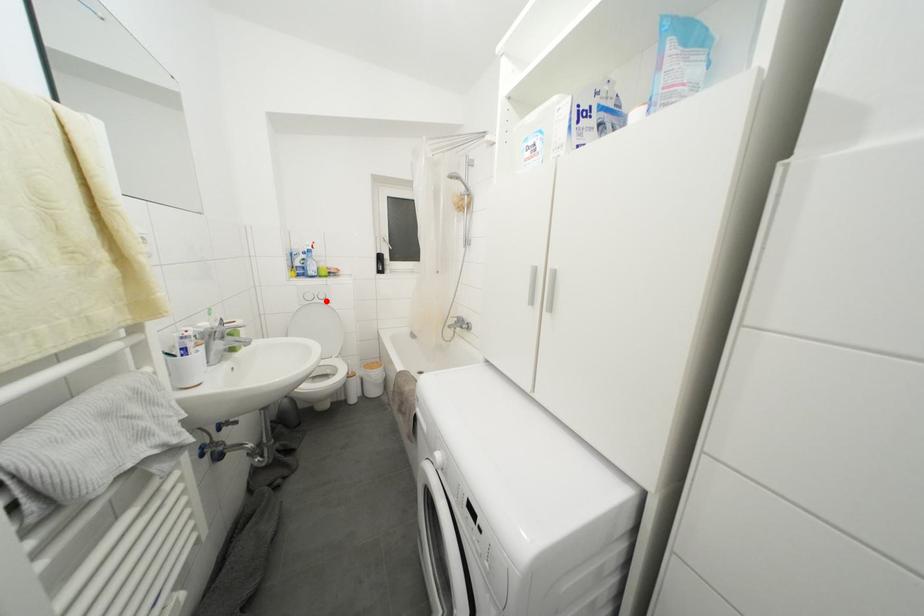
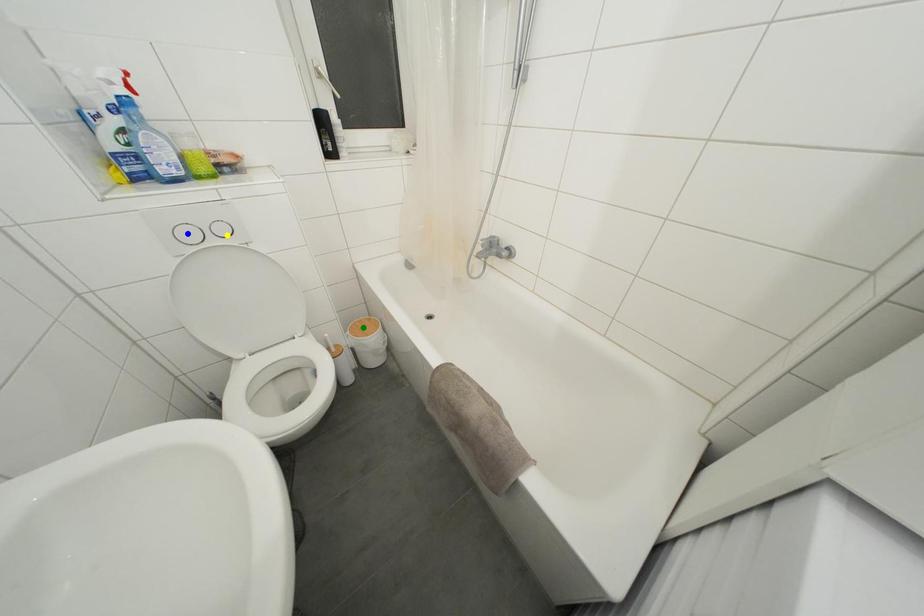
Question: I am providing you with two images of the same scene from different viewpoints. A red point is marked on the first image. You are given multiple points on the second image. Which mark in image 2 goes with the point in image 1?

Choices:
 (A) yellow point
 (B) blue point
 (C) green point

Answer: (A)